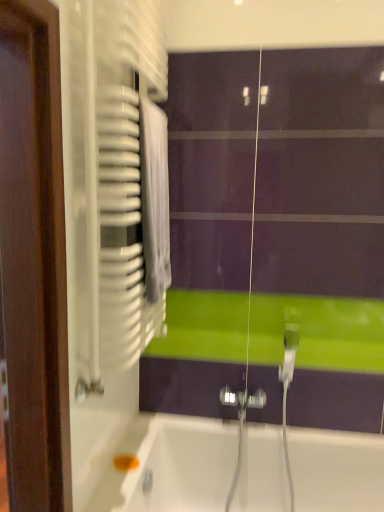
Question: Is white plastic radiator at left far from white glossy bathtub at lower center?

Choices:
 (A) no
 (B) yes

Answer: (A)

Question: From the image's perspective, would you say white plastic radiator at left is shown under white glossy bathtub at lower center?

Choices:
 (A) yes
 (B) no

Answer: (B)

Question: Can you confirm if white plastic radiator at left is positioned to the right of white glossy bathtub at lower center?

Choices:
 (A) no
 (B) yes

Answer: (A)

Question: Is white plastic radiator at left facing away from white glossy bathtub at lower center?

Choices:
 (A) yes
 (B) no

Answer: (B)

Question: Can white glossy bathtub at lower center be found inside white plastic radiator at left?

Choices:
 (A) yes
 (B) no

Answer: (B)

Question: From a real-world perspective, is white plastic radiator at left located higher than white glossy bathtub at lower center?

Choices:
 (A) yes
 (B) no

Answer: (A)

Question: Could you tell me if white glossy bathtub at lower center is turned towards white plastic radiator at left?

Choices:
 (A) no
 (B) yes

Answer: (A)

Question: Is white glossy bathtub at lower center smaller than white plastic radiator at left?

Choices:
 (A) yes
 (B) no

Answer: (B)

Question: Can you confirm if white glossy bathtub at lower center is positioned to the right of white plastic radiator at left?

Choices:
 (A) no
 (B) yes

Answer: (B)

Question: Is white glossy bathtub at lower center next to white plastic radiator at left?

Choices:
 (A) no
 (B) yes

Answer: (A)

Question: Is white glossy bathtub at lower center at the left side of white plastic radiator at left?

Choices:
 (A) yes
 (B) no

Answer: (B)

Question: From a real-world perspective, is white glossy bathtub at lower center physically above white plastic radiator at left?

Choices:
 (A) no
 (B) yes

Answer: (A)

Question: From their relative heights in the image, would you say white glossy bathtub at lower center is taller or shorter than white plastic radiator at left?

Choices:
 (A) short
 (B) tall

Answer: (A)